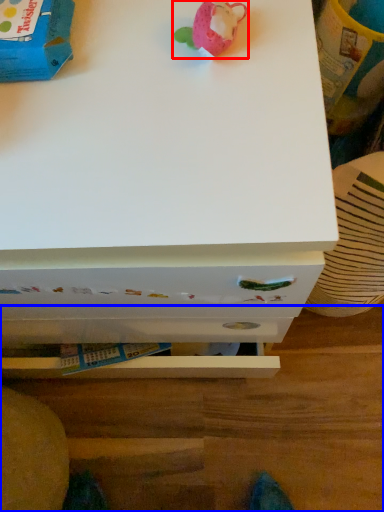
Question: Which object is closer to the camera taking this photo, toy (highlighted by a red box) or table (highlighted by a blue box)?

Choices:
 (A) toy
 (B) table

Answer: (A)